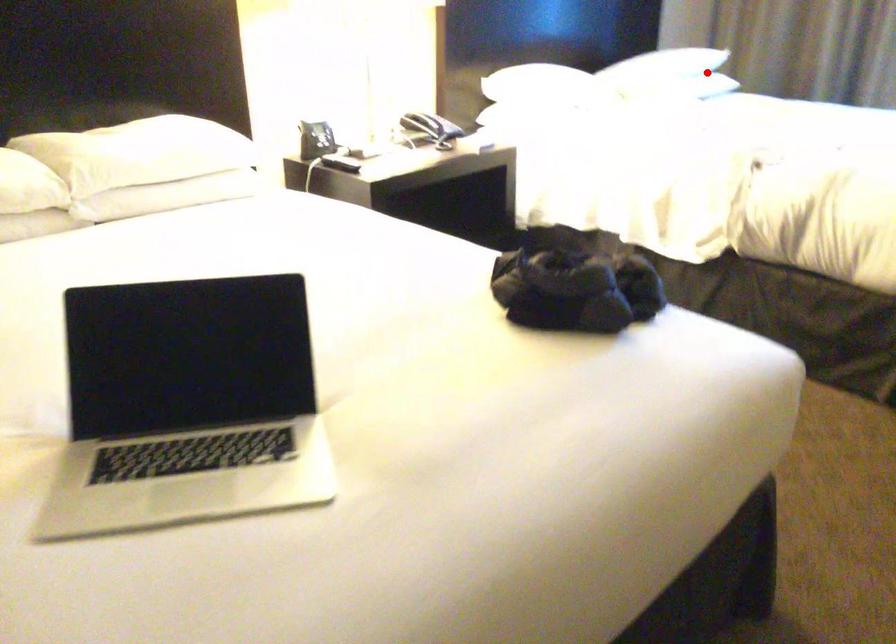
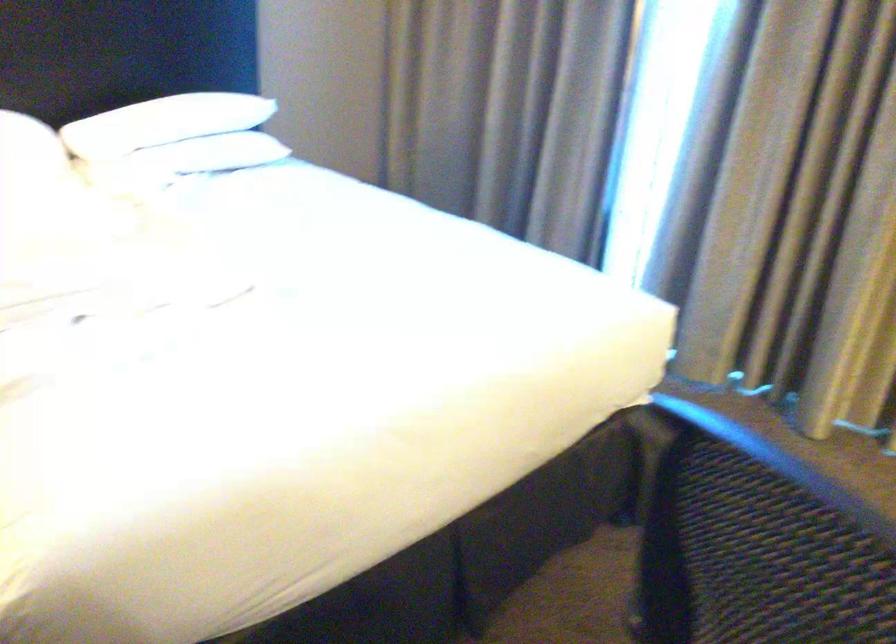
Locate, in the second image, the point that corresponds to the highlighted location in the first image.

(203, 155)